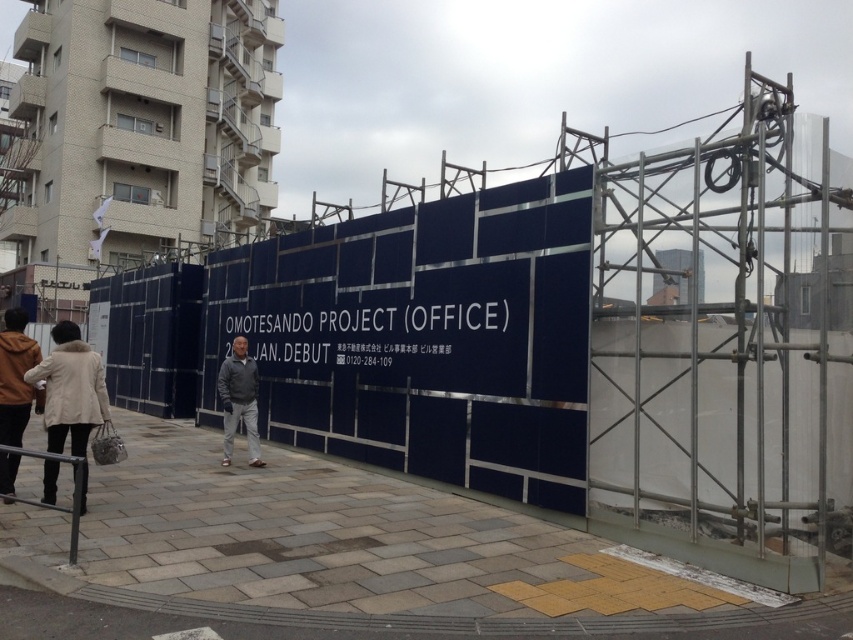
Which is more to the right, beige wool coat at lower left or dark gray jacket at center?

Positioned to the right is dark gray jacket at center.

Image resolution: width=853 pixels, height=640 pixels. What do you see at coordinates (54, 381) in the screenshot? I see `beige wool coat at lower left` at bounding box center [54, 381].

Where is `beige wool coat at lower left`? Image resolution: width=853 pixels, height=640 pixels. beige wool coat at lower left is located at coordinates (54, 381).